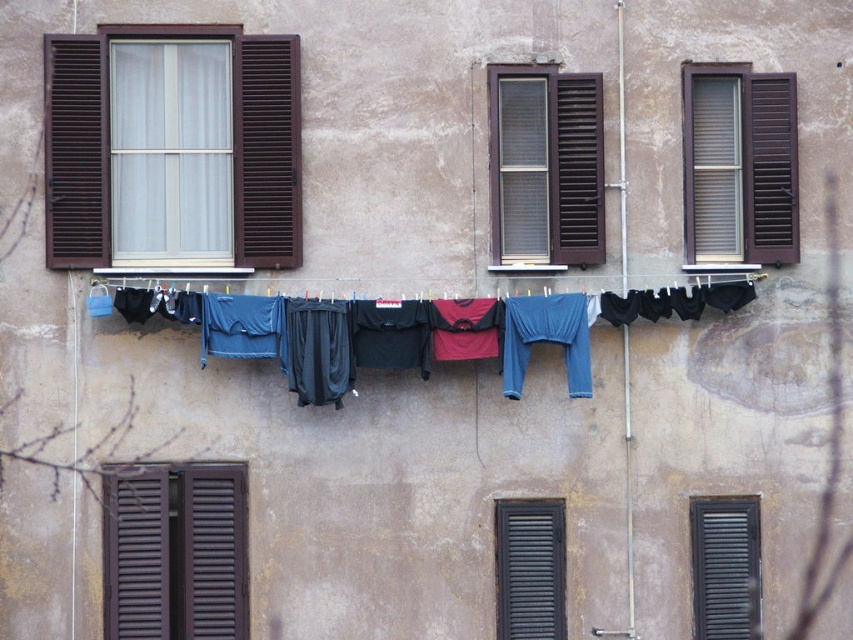
Find the location of a particular element. The image size is (853, 640). brown wooden window at upper left is located at coordinates pyautogui.click(x=231, y=147).

Who is more distant from viewer, (260, 224) or (704, 579)?

Point (704, 579)

The image size is (853, 640). Identify the location of brown wooden window at upper left. (231, 147).

Which is above, brown wooden window at upper right or brown wooden window at center?

Positioned higher is brown wooden window at upper right.

I want to click on brown wooden window at upper right, so click(x=740, y=164).

Does point (743, 104) come farther from viewer compared to point (569, 177)?

Yes, point (743, 104) is farther from viewer.

In order to click on brown wooden window at upper right in this screenshot , I will do `click(740, 164)`.

Who is positioned more to the left, blue fabric clothes at center or brown wooden window at upper right?

Positioned to the left is blue fabric clothes at center.

Which is in front, point (282, 340) or point (785, 150)?

Point (282, 340) is in front.

Where is `blue fabric clothes at center`? The image size is (853, 640). blue fabric clothes at center is located at coordinates (316, 333).